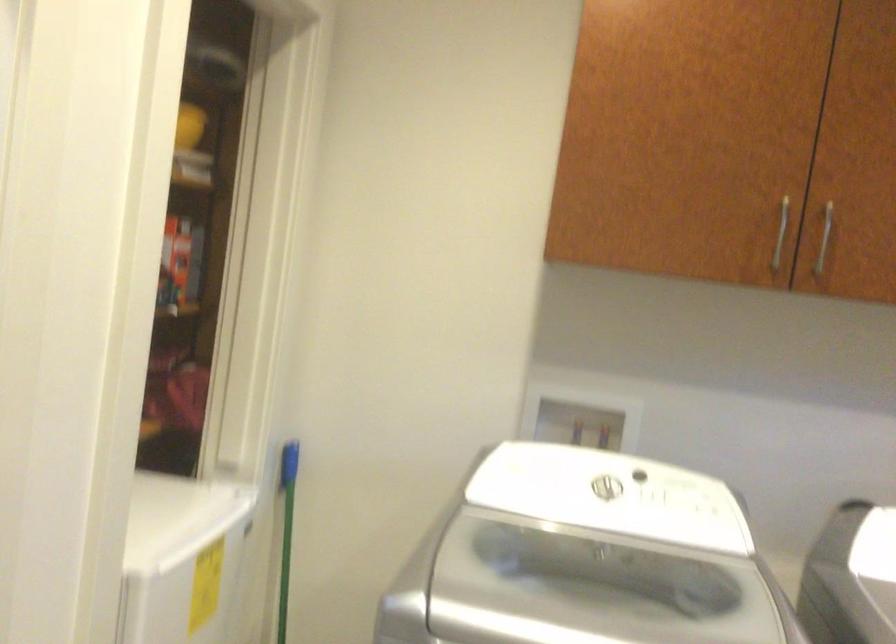
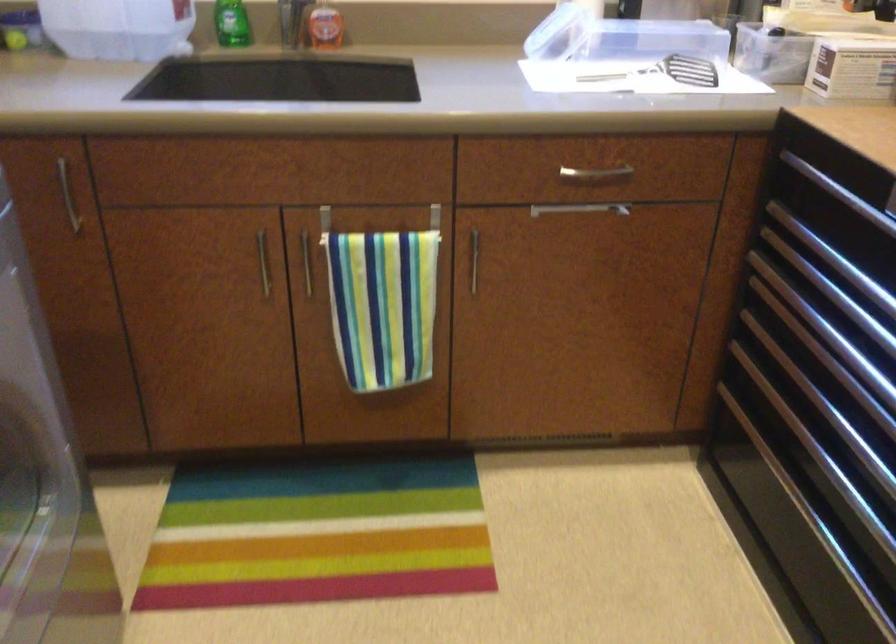
How did the camera likely rotate?

The camera rotated toward right-down.